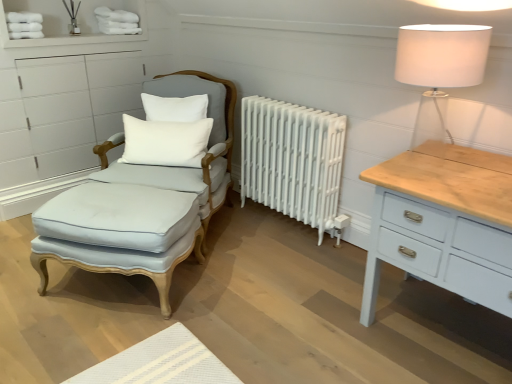
Question: Does light blue fabric footrest at left have a larger size compared to light blue fabric swivel chair at left?

Choices:
 (A) yes
 (B) no

Answer: (B)

Question: Does light blue fabric footrest at left come in front of light blue fabric swivel chair at left?

Choices:
 (A) no
 (B) yes

Answer: (B)

Question: Considering the relative sizes of light blue fabric footrest at left and light blue fabric swivel chair at left in the image provided, is light blue fabric footrest at left thinner than light blue fabric swivel chair at left?

Choices:
 (A) yes
 (B) no

Answer: (A)

Question: From a real-world perspective, is light blue fabric footrest at left positioned over light blue fabric swivel chair at left based on gravity?

Choices:
 (A) no
 (B) yes

Answer: (A)

Question: Can you confirm if light blue fabric footrest at left is taller than light blue fabric swivel chair at left?

Choices:
 (A) yes
 (B) no

Answer: (B)

Question: Is light blue fabric footrest at left taller or shorter than white painted metal radiator at center?

Choices:
 (A) tall
 (B) short

Answer: (B)

Question: Looking at the image, does light blue fabric footrest at left seem bigger or smaller compared to white painted metal radiator at center?

Choices:
 (A) big
 (B) small

Answer: (A)

Question: Relative to white painted metal radiator at center, is light blue fabric footrest at left in front or behind?

Choices:
 (A) behind
 (B) front

Answer: (B)

Question: Is point (147, 233) closer or farther from the camera than point (311, 185)?

Choices:
 (A) closer
 (B) farther

Answer: (A)

Question: Which is correct: white cotton pillow at center, placed as the 2th pillow when sorted from top to bottom, is inside white cotton pillow at upper center, which ranks as the first pillow in top-to-bottom order, or outside of it?

Choices:
 (A) inside
 (B) outside

Answer: (B)

Question: Considering the positions of white cotton pillow at center, placed as the 2th pillow when sorted from top to bottom, and white cotton pillow at upper center, which ranks as the first pillow in top-to-bottom order, in the image, is white cotton pillow at center, placed as the 2th pillow when sorted from top to bottom, taller or shorter than white cotton pillow at upper center, which ranks as the first pillow in top-to-bottom order,?

Choices:
 (A) short
 (B) tall

Answer: (B)

Question: Considering their positions, is white cotton pillow at center, the first pillow in the bottom-to-top sequence, located in front of or behind white cotton pillow at upper center, which ranks as the first pillow in top-to-bottom order?

Choices:
 (A) front
 (B) behind

Answer: (A)

Question: From a real-world perspective, is white cotton pillow at center, the first pillow in the bottom-to-top sequence, positioned above or below white cotton pillow at upper center, the second pillow ordered from the bottom?

Choices:
 (A) above
 (B) below

Answer: (B)

Question: In the image, is white cotton pillow at center, the first pillow in the bottom-to-top sequence, positioned in front of or behind light blue fabric footrest at left?

Choices:
 (A) front
 (B) behind

Answer: (B)

Question: Considering the positions of white cotton pillow at center, the first pillow in the bottom-to-top sequence, and light blue fabric footrest at left in the image, is white cotton pillow at center, the first pillow in the bottom-to-top sequence, taller or shorter than light blue fabric footrest at left?

Choices:
 (A) tall
 (B) short

Answer: (B)